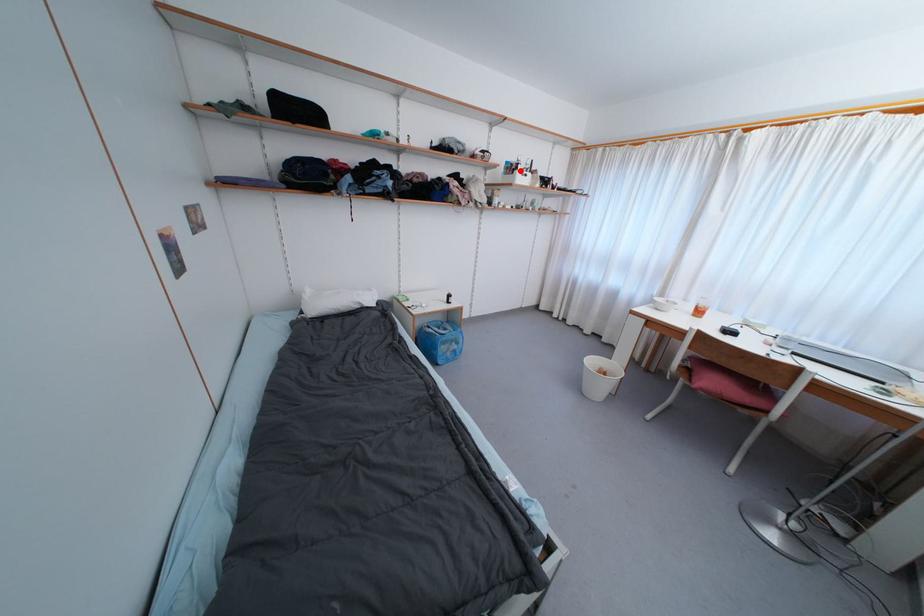
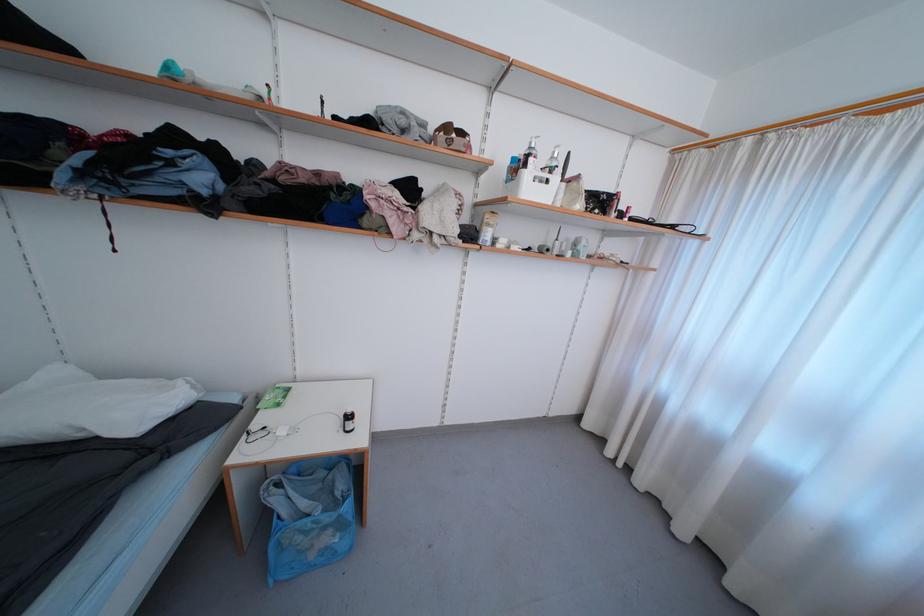
Where in the second image is the point corresponding to the highlighted location from the first image?

(529, 168)